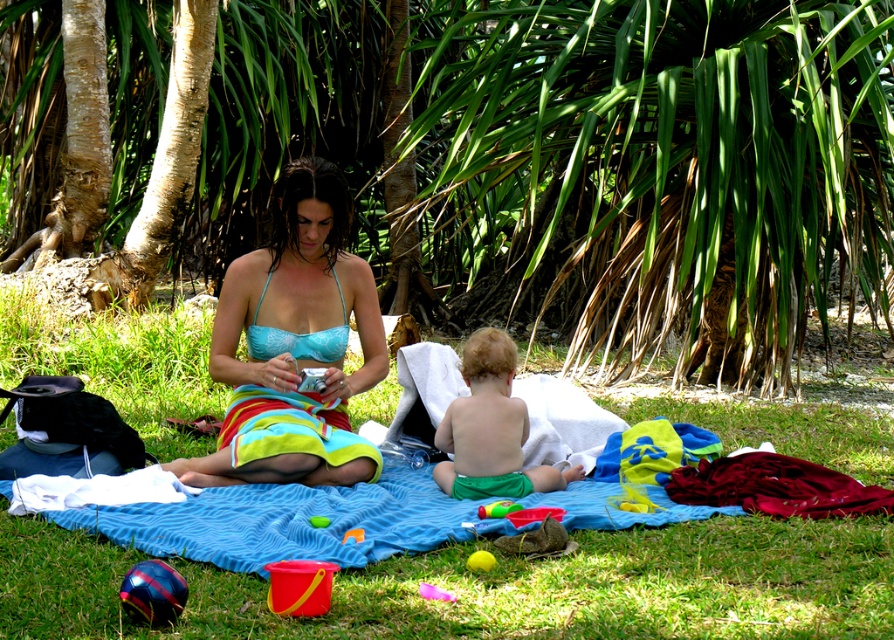
From the picture: You are a photographer trying to capture the child in the scene. The child is wearing green cotton shorts at center and there is a yellow rubber ball at lower center. Which object is closer to the camera?

The green cotton shorts at center is positioned over yellow rubber ball at lower center, so the green cotton shorts at center is closer to the camera.

You are a photographer taking a picture of the green cotton shorts at center and the yellow rubber ball at lower center. Which object should you focus on first if you want to capture both in the same frame without moving the camera?

Since the green cotton shorts at center is larger in size compared to the yellow rubber ball at lower center, you should focus on the green cotton shorts at center first to ensure proper framing and depth of field for both objects.

You are planning to throw the yellow rubber ball at lower center to the child on the white towel. Considering the green leafy palm tree at center is above it, will the ball pass under the tree?

The green leafy palm tree at center is positioned over the yellow rubber ball at lower center, so the ball will pass under the tree when thrown towards the child.